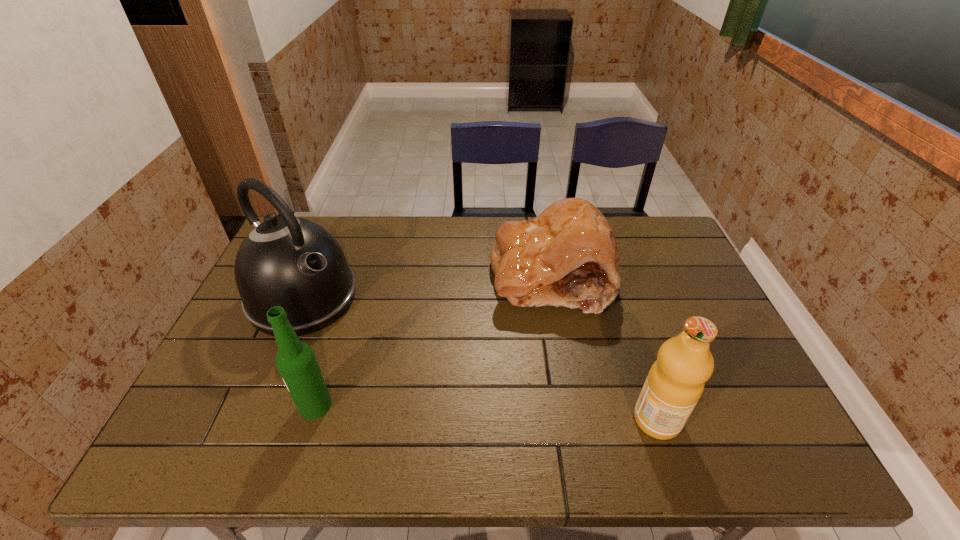
Image resolution: width=960 pixels, height=540 pixels. I want to click on vacant space situated on the filling side of the shortest object, so click(x=455, y=397).

The height and width of the screenshot is (540, 960). Find the location of `vacant point located on the spout of the kettle`. vacant point located on the spout of the kettle is located at coordinates (362, 343).

Where is `vacant space located 0.360m on the spout of the kettle`? vacant space located 0.360m on the spout of the kettle is located at coordinates (430, 395).

Image resolution: width=960 pixels, height=540 pixels. In order to click on vacant space located 0.290m on the spout of the kettle in this screenshot , I will do `click(410, 379)`.

Image resolution: width=960 pixels, height=540 pixels. Find the location of `object at the far edge`. object at the far edge is located at coordinates (567, 256).

At what (x,y) coordinates should I click in order to perform the action: click on beer bottle that is at the near edge. Please return your answer as a coordinate pair (x, y). This screenshot has width=960, height=540. Looking at the image, I should click on (296, 362).

Image resolution: width=960 pixels, height=540 pixels. Identify the location of fruit juice present at the near edge. (675, 382).

I want to click on object that is at the left edge, so click(x=291, y=262).

This screenshot has height=540, width=960. I want to click on free spot at the far edge of the desktop, so click(x=627, y=240).

The height and width of the screenshot is (540, 960). In the image, there is a desktop. Find the location of `free space at the near edge`. free space at the near edge is located at coordinates (372, 417).